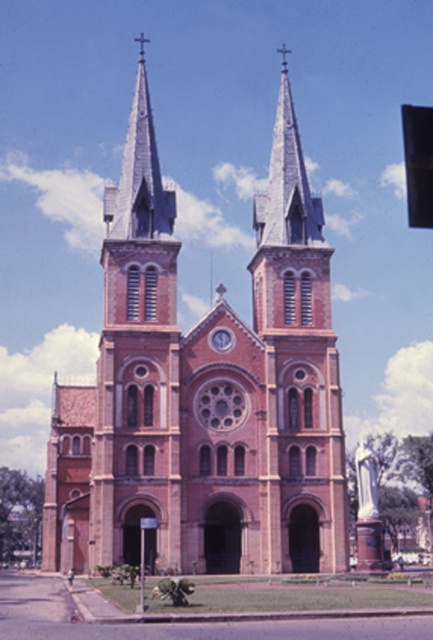
I want to click on red brick church at center, so click(203, 390).

Between red brick church at center and smooth gray steeple at center, which one has more height?

red brick church at center is taller.

Who is more forward, (300,324) or (138,337)?

Point (138,337) is in front.

Locate an element on the screen. red brick church at center is located at coordinates (203, 390).

Which is in front, point (112, 376) or point (412, 116)?

Point (412, 116) is in front.

Can you confirm if smooth gray steeple at center is taller than black plastic traffic light at upper right?

Yes, smooth gray steeple at center is taller than black plastic traffic light at upper right.

Does point (139, 90) come behind point (427, 170)?

That is True.

Where is `smooth gray steeple at center`? Image resolution: width=433 pixels, height=640 pixels. smooth gray steeple at center is located at coordinates (136, 353).

Between smooth gray steeple at center and matte brown clock at center, which one has more height?

smooth gray steeple at center

Is point (122, 436) positioned behind point (216, 344)?

No.

Is point (128, 364) farther from viewer compared to point (213, 337)?

No, (128, 364) is in front of (213, 337).

I want to click on smooth gray steeple at center, so click(136, 353).